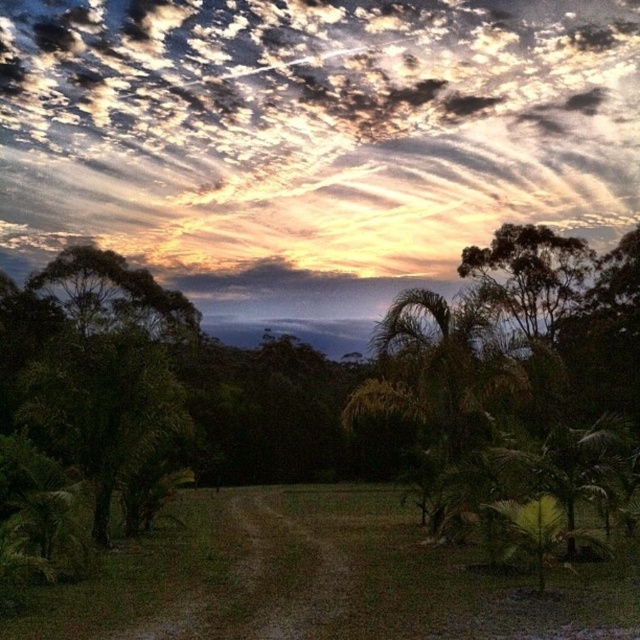
Can you confirm if green leafy palm at center is thinner than green leafy tree at left?

No.

Is point (547, 337) behind point (61, 337)?

That is True.

Find the location of `green leafy palm at center`. green leafy palm at center is located at coordinates (518, 374).

Can you confirm if cloudy sky at upper center is thinner than green leafy palm at center?

No, cloudy sky at upper center is not thinner than green leafy palm at center.

Which is below, cloudy sky at upper center or green leafy palm at center?

Positioned lower is green leafy palm at center.

Does point (209, 170) come farther from viewer compared to point (616, 294)?

Yes, point (209, 170) is behind point (616, 294).

Identify the location of cloudy sky at upper center. (312, 140).

Between point (538, 548) and point (499, 273), which one is positioned in front?

Point (538, 548) is more forward.

Does green leafy palm at center have a lesser width compared to green leafy tree at upper right?

Incorrect, green leafy palm at center's width is not less than green leafy tree at upper right's.

Is point (588, 328) closer to camera compared to point (580, 288)?

Yes.

Identify the location of green leafy palm at center. (518, 374).